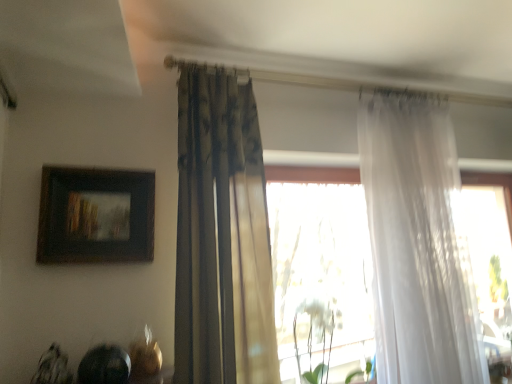
Question: Is point (330, 357) positioned closer to the camera than point (458, 309)?

Choices:
 (A) farther
 (B) closer

Answer: (B)

Question: Is white matte plant at center to the left or to the right of translucent white curtain at right, the 1th curtain in the right-to-left sequence, in the image?

Choices:
 (A) right
 (B) left

Answer: (B)

Question: Considering the real-world distances, which object is farthest from the wooden framed painting at upper left?

Choices:
 (A) white matte plant at center
 (B) textured beige curtain at center, which is counted as the first curtain, starting from the left
 (C) translucent white curtain at right, the 1th curtain in the right-to-left sequence

Answer: (C)

Question: Considering the real-world distances, which object is closest to the wooden framed painting at upper left?

Choices:
 (A) white matte plant at center
 (B) textured beige curtain at center, which ranks as the 2th curtain in right-to-left order
 (C) translucent white curtain at right, the second curtain viewed from the left

Answer: (B)